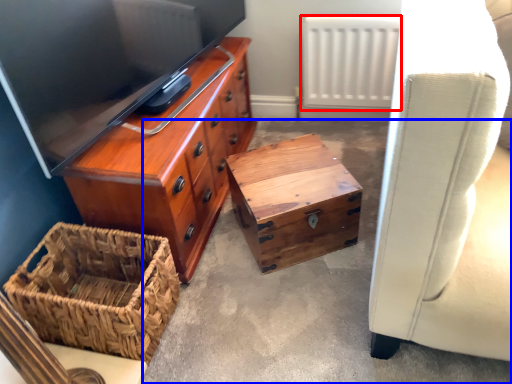
Question: Among these objects, which one is farthest to the camera, radiator (highlighted by a red box) or concrete (highlighted by a blue box)?

Choices:
 (A) radiator
 (B) concrete

Answer: (A)